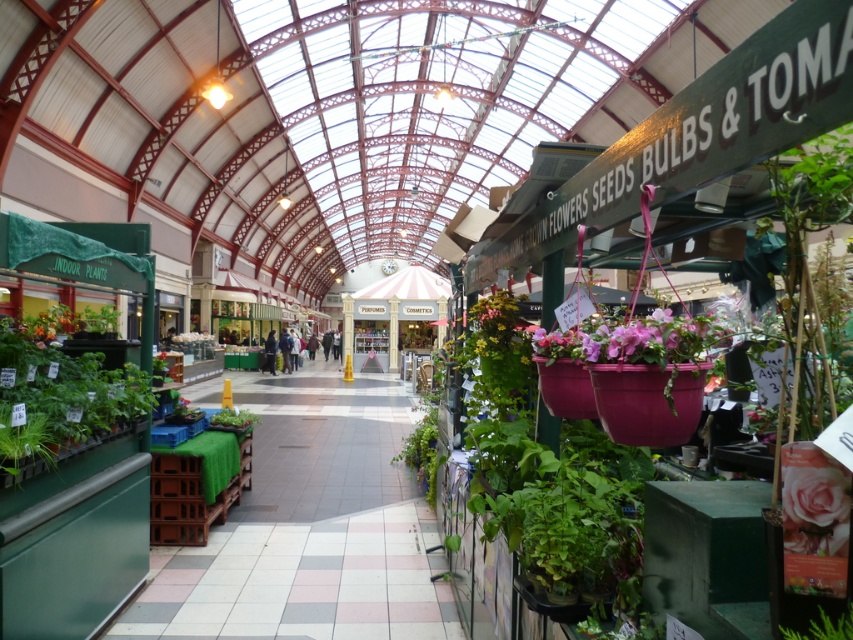
Question: Is pink matte flower pot at center positioned in front of pink matte rose at lower right?

Choices:
 (A) yes
 (B) no

Answer: (B)

Question: Which object is closer to the camera taking this photo?

Choices:
 (A) pink matte flower pot at center
 (B) pink matte rose at lower right

Answer: (B)

Question: Observing the image, what is the correct spatial positioning of pink matte flower pot at center in reference to pink matte rose at lower right?

Choices:
 (A) above
 (B) below

Answer: (A)

Question: Is pink matte flower pot at center below pink matte rose at lower right?

Choices:
 (A) yes
 (B) no

Answer: (B)